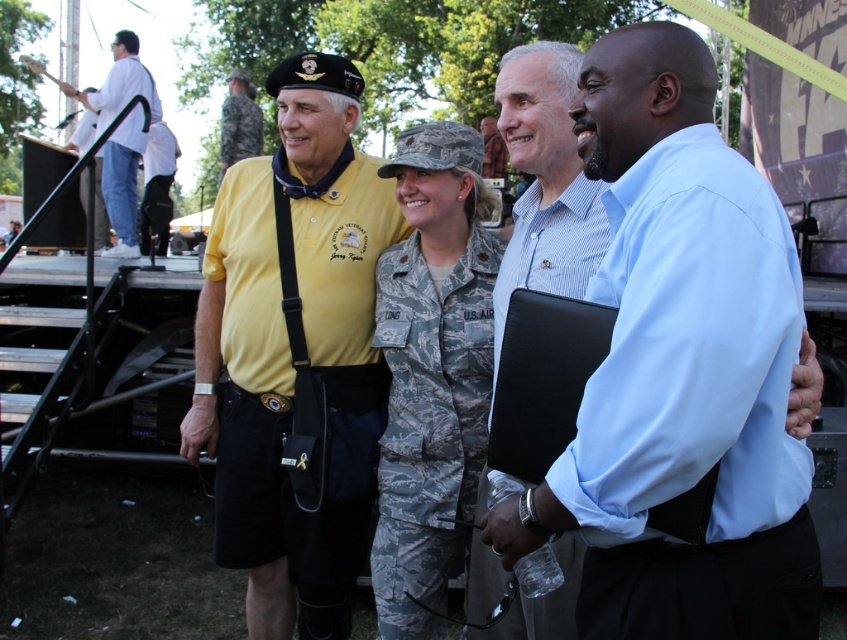
You are organizing a photo shoot and need to arrange two shirts for a display. The light blue shirt at center and the white cotton shirt at upper left are available. Based on their sizes, which shirt should be placed on the narrower hanger?

The light blue shirt at center has a lesser width compared to the white cotton shirt at upper left, so it should be placed on the narrower hanger.

You are an event organizer who needs to arrange seating for two individuals based on their heights. You see the camo uniform at center and the white cotton shirt at upper left. Which person should you seat in the front row to ensure they have a better view?

The camo uniform at center is shorter than the white cotton shirt at upper left, so the person in the camo uniform at center should be seated in the front row to ensure they have a better view.